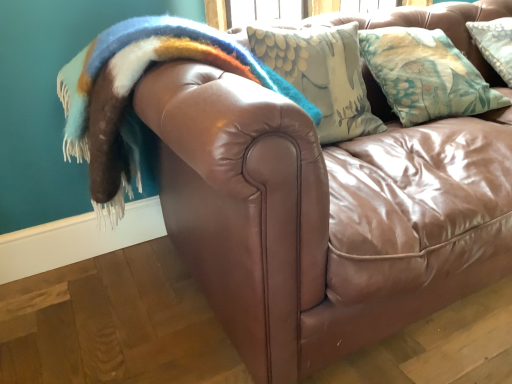
Describe the element at coordinates (133, 88) in the screenshot. I see `fuzzy woolen blanket at upper left` at that location.

Identify the location of fuzzy woolen blanket at upper left. Image resolution: width=512 pixels, height=384 pixels. (133, 88).

Looking at this image, measure the distance between point (419, 94) and camera.

4.53 feet.

I want to click on floral fabric pillow at upper right, so click(x=425, y=75).

What do you see at coordinates (425, 75) in the screenshot?
I see `floral fabric pillow at upper right` at bounding box center [425, 75].

Where is `fuzzy woolen blanket at upper left`? This screenshot has width=512, height=384. fuzzy woolen blanket at upper left is located at coordinates (133, 88).

Considering the positions of objects fuzzy woolen blanket at upper left and floral fabric pillow at upper right in the image provided, who is more to the right, fuzzy woolen blanket at upper left or floral fabric pillow at upper right?

Positioned to the right is floral fabric pillow at upper right.

In the image, is fuzzy woolen blanket at upper left positioned in front of or behind floral fabric pillow at upper right?

Clearly, fuzzy woolen blanket at upper left is in front of floral fabric pillow at upper right.

Does point (174, 36) appear closer or farther from the camera than point (455, 61)?

Point (174, 36) is positioned closer to the camera compared to point (455, 61).

From the image's perspective, who appears lower, fuzzy woolen blanket at upper left or floral fabric pillow at upper right?

fuzzy woolen blanket at upper left appears lower in the image.

From a real-world perspective, is fuzzy woolen blanket at upper left physically above floral fabric pillow at upper right?

Yes, from a real-world perspective, fuzzy woolen blanket at upper left is over floral fabric pillow at upper right

Which object is wider, fuzzy woolen blanket at upper left or floral fabric pillow at upper right?

Wider between the two is fuzzy woolen blanket at upper left.

Does fuzzy woolen blanket at upper left have a greater height compared to floral fabric pillow at upper right?

Correct, fuzzy woolen blanket at upper left is much taller as floral fabric pillow at upper right.

Can you confirm if fuzzy woolen blanket at upper left is smaller than floral fabric pillow at upper right?

Actually, fuzzy woolen blanket at upper left might be larger than floral fabric pillow at upper right.

Is fuzzy woolen blanket at upper left outside of floral fabric pillow at upper right?

Yes, fuzzy woolen blanket at upper left is outside of floral fabric pillow at upper right.

Is fuzzy woolen blanket at upper left touching floral fabric pillow at upper right?

No, fuzzy woolen blanket at upper left is not next to floral fabric pillow at upper right.

Could you tell me if fuzzy woolen blanket at upper left is turned towards floral fabric pillow at upper right?

No, fuzzy woolen blanket at upper left is not facing towards floral fabric pillow at upper right.

How many degrees apart are the facing directions of fuzzy woolen blanket at upper left and floral fabric pillow at upper right?

They differ by 49.5 degrees in their facing directions.

Identify the location of blanket above the floral fabric pillow at upper right (from a real-world perspective). (133, 88).

Which object is positioned more to the right, floral fabric pillow at upper right or fuzzy woolen blanket at upper left?

From the viewer's perspective, floral fabric pillow at upper right appears more on the right side.

Between floral fabric pillow at upper right and fuzzy woolen blanket at upper left, which one is positioned behind?

floral fabric pillow at upper right is further away from the camera.

Which is more distant, [417,64] or [104,173]?

The point [417,64] is behind.

From the image's perspective, is floral fabric pillow at upper right located above or below fuzzy woolen blanket at upper left?

From the image's perspective, floral fabric pillow at upper right appears above fuzzy woolen blanket at upper left.

From a real-world perspective, is floral fabric pillow at upper right physically located above or below fuzzy woolen blanket at upper left?

floral fabric pillow at upper right is situated lower than fuzzy woolen blanket at upper left in the real world.

Consider the image. Is floral fabric pillow at upper right wider or thinner than fuzzy woolen blanket at upper left?

In the image, floral fabric pillow at upper right appears to be more narrow than fuzzy woolen blanket at upper left.

Based on the photo, considering the relative sizes of floral fabric pillow at upper right and fuzzy woolen blanket at upper left in the image provided, is floral fabric pillow at upper right shorter than fuzzy woolen blanket at upper left?

Yes, floral fabric pillow at upper right is shorter than fuzzy woolen blanket at upper left.

From the picture: Is floral fabric pillow at upper right bigger than fuzzy woolen blanket at upper left?

No.

Is floral fabric pillow at upper right completely or partially outside of fuzzy woolen blanket at upper left?

Indeed, floral fabric pillow at upper right is completely outside fuzzy woolen blanket at upper left.

Is floral fabric pillow at upper right with fuzzy woolen blanket at upper left?

No, floral fabric pillow at upper right is not next to fuzzy woolen blanket at upper left.

Does floral fabric pillow at upper right turn towards fuzzy woolen blanket at upper left?

No, floral fabric pillow at upper right is not turned towards fuzzy woolen blanket at upper left.

Can you tell me how much floral fabric pillow at upper right and fuzzy woolen blanket at upper left differ in facing direction?

They differ by 49.5 degrees in their facing directions.

Locate an element on the screen. The image size is (512, 384). blanket on the left of the floral fabric pillow at upper right is located at coordinates (133, 88).

Locate an element on the screen. pillow that appears above the fuzzy woolen blanket at upper left (from the image's perspective) is located at coordinates (425, 75).

Find the location of a particular element. The width and height of the screenshot is (512, 384). blanket that is below the floral fabric pillow at upper right (from the image's perspective) is located at coordinates (133, 88).